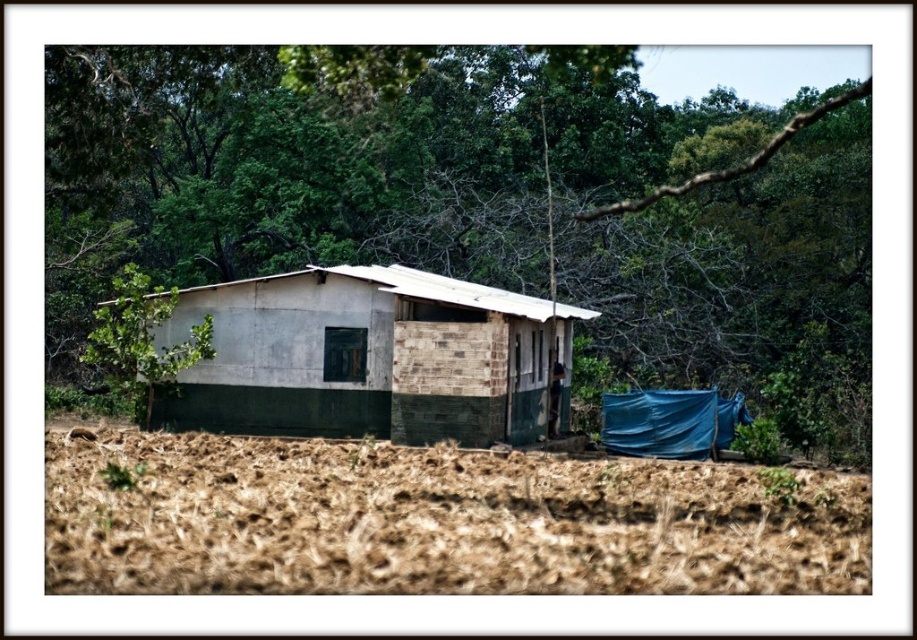
Question: Which point is closer to the camera taking this photo?

Choices:
 (A) (349, 285)
 (B) (149, 572)

Answer: (B)

Question: Which point is closer to the camera?

Choices:
 (A) brown soil at lower center
 (B) green leafy tree at upper center

Answer: (A)

Question: Does brown soil at lower center have a larger size compared to white concrete hut at center?

Choices:
 (A) yes
 (B) no

Answer: (A)

Question: Is brown soil at lower center positioned behind white concrete hut at center?

Choices:
 (A) yes
 (B) no

Answer: (B)

Question: Which object appears farthest from the camera in this image?

Choices:
 (A) green leafy tree at upper center
 (B) brown soil at lower center

Answer: (A)

Question: Can you confirm if green leafy tree at upper center is smaller than white concrete hut at center?

Choices:
 (A) no
 (B) yes

Answer: (A)